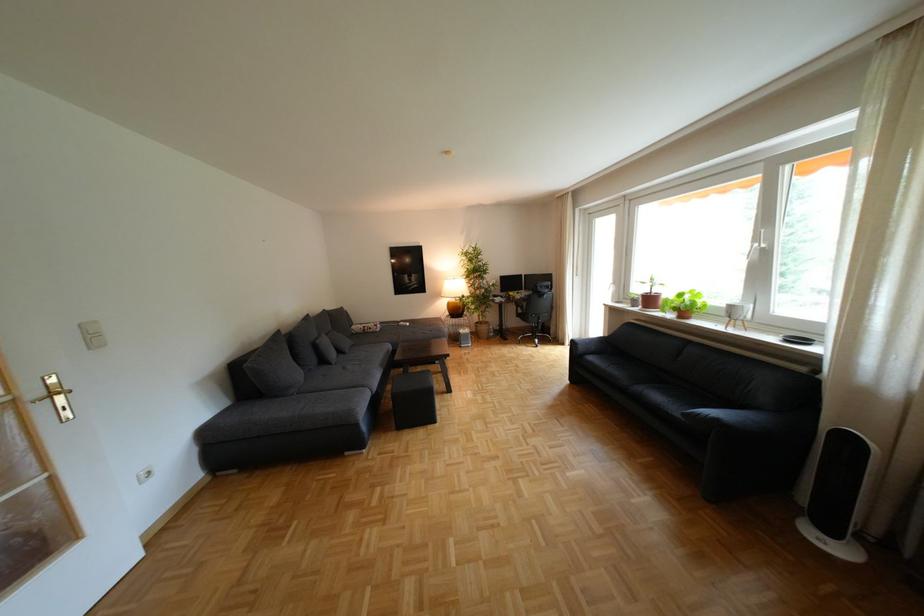
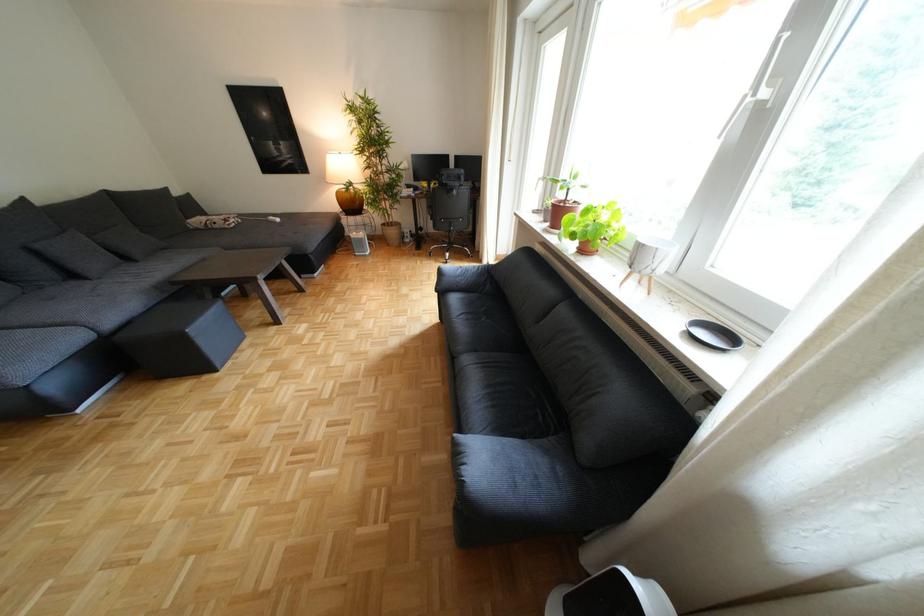
Locate, in the second image, the point that corresponds to point (490, 323) in the first image.

(396, 224)